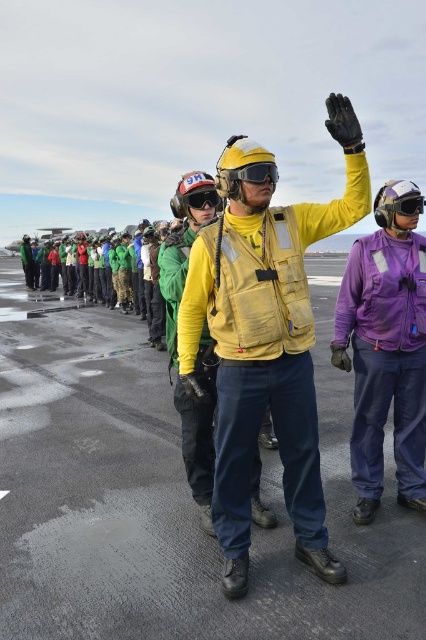
You are standing on the glossy asphalt tarmac at center and want to reach the yellow fabric vest at center. Which direction should you move to get closer?

The glossy asphalt tarmac at center is further to the viewer than the yellow fabric vest at center, so you should move forward to get closer to the yellow fabric vest at center.

Looking at this image, based on the scene description, what is the 2D coordinate of the yellow fabric vest at center?

The yellow fabric vest at center is located at the 2D coordinate point of (x=256, y=444).